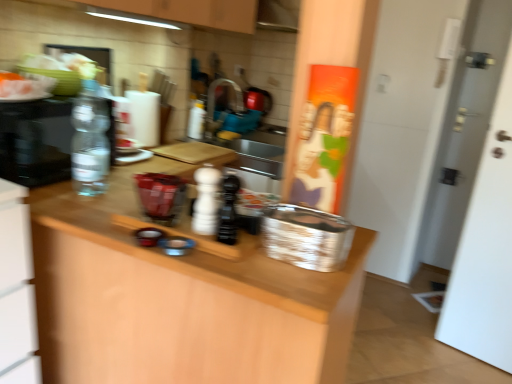
Where is `free space in front of white matte pepper shaker at center, the second bottle positioned from the right`? The width and height of the screenshot is (512, 384). free space in front of white matte pepper shaker at center, the second bottle positioned from the right is located at coordinates (211, 247).